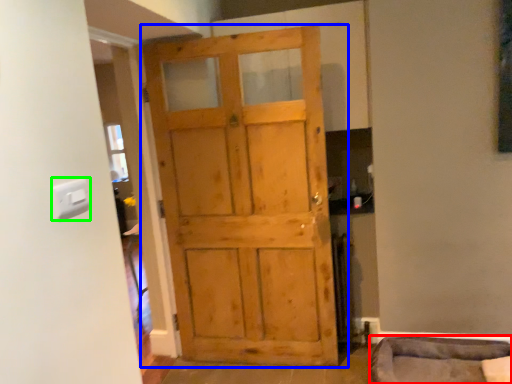
Question: Which is nearer to the furniture (highlighted by a red box)? door (highlighted by a blue box) or light switch (highlighted by a green box).

Choices:
 (A) door
 (B) light switch

Answer: (A)